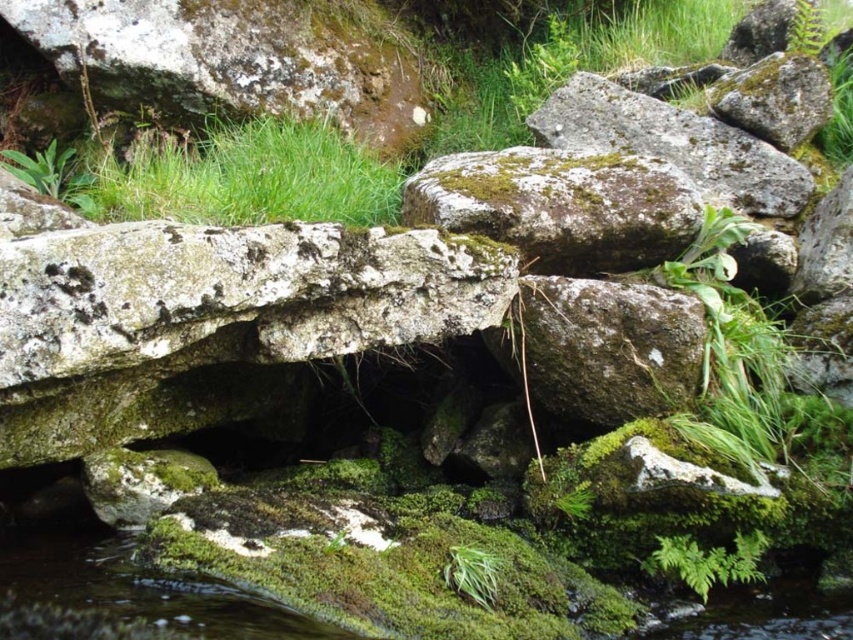
You are a geologist examining the image. You need to locate the mossy stone at upper left. Where exactly is it located in the image?

The mossy stone at upper left is located at point coordinates of (239, 60).

You are a hiker trying to cross a stream in the scene. You see the green mossy grass at upper center and the green leafy fern at lower right. Which plant should you avoid stepping on if you want to choose the taller one to step over?

You should avoid stepping on the green mossy grass at upper center because it is taller than the green leafy fern at lower right.